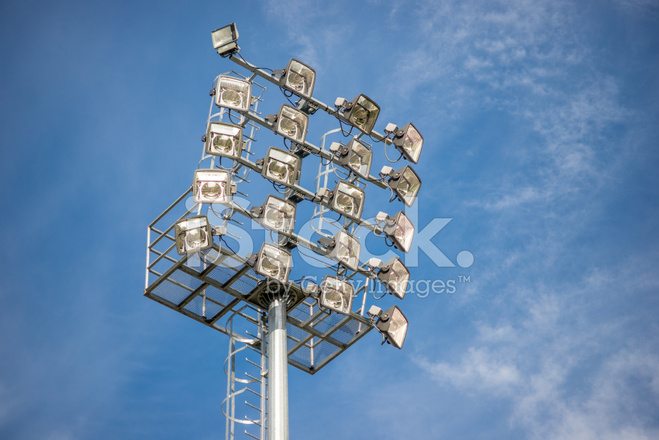
Locate an element on the screen. Image resolution: width=659 pixels, height=440 pixels. the bottom row of lights is located at coordinates (194, 235), (273, 266), (335, 296), (389, 324).